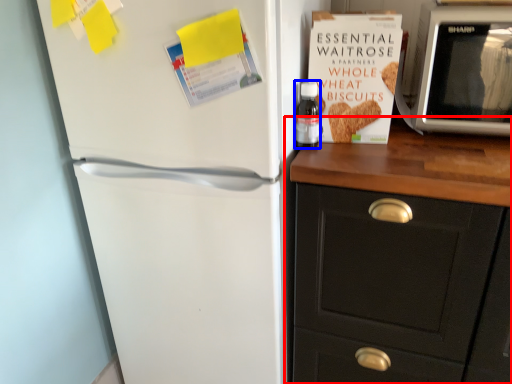
Question: Which object is closer to the camera taking this photo, cabinetry (highlighted by a red box) or bottle (highlighted by a blue box)?

Choices:
 (A) cabinetry
 (B) bottle

Answer: (A)